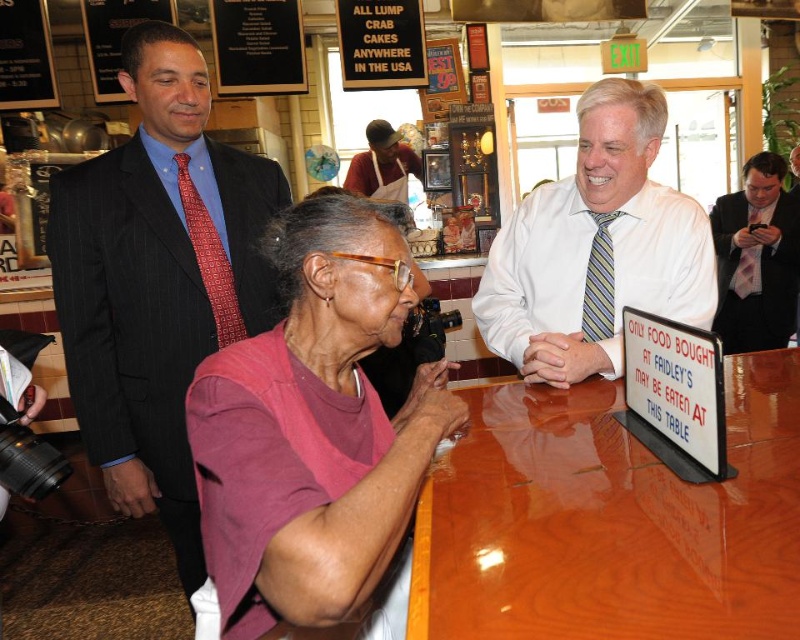
Question: Considering the relative positions of pink fabric shirt at center and dark blue suit at center in the image provided, where is pink fabric shirt at center located with respect to dark blue suit at center?

Choices:
 (A) left
 (B) right

Answer: (B)

Question: Which object is farther from the camera taking this photo?

Choices:
 (A) pink fabric shirt at center
 (B) white striped tie at center
 (C) glossy wood table at center

Answer: (B)

Question: Can you confirm if pink fabric shirt at center is thinner than white apron at center?

Choices:
 (A) no
 (B) yes

Answer: (B)

Question: Among these objects, which one is farthest from the camera?

Choices:
 (A) white striped tie at center
 (B) dark blue suit at center

Answer: (B)

Question: Is pink fabric shirt at right thinner than white apron at center?

Choices:
 (A) yes
 (B) no

Answer: (A)

Question: Which point is closer to the camera?

Choices:
 (A) (372, 132)
 (B) (564, 460)
 (C) (180, 138)

Answer: (B)